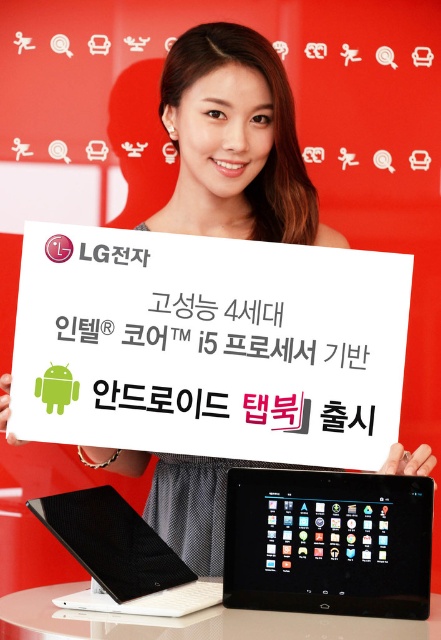
Question: Does black carbon fiber tablet at lower center appear on the left side of white glossy table at lower center?

Choices:
 (A) no
 (B) yes

Answer: (B)

Question: Can you confirm if black glossy tablet at center is smaller than white glossy table at lower center?

Choices:
 (A) yes
 (B) no

Answer: (A)

Question: Does white paper at center have a lesser width compared to black carbon fiber tablet at lower center?

Choices:
 (A) yes
 (B) no

Answer: (B)

Question: Considering the real-world distances, which object is closest to the black carbon fiber tablet at lower center?

Choices:
 (A) black glossy tablet at center
 (B) white glossy table at lower center
 (C) white paper at center

Answer: (B)

Question: Based on their relative distances, which object is nearer to the white paper at center?

Choices:
 (A) black glossy tablet at center
 (B) white glossy table at lower center

Answer: (A)

Question: Estimate the real-world distances between objects in this image. Which object is closer to the white paper at center?

Choices:
 (A) black carbon fiber tablet at lower center
 (B) black glossy tablet at center
 (C) white glossy table at lower center

Answer: (B)